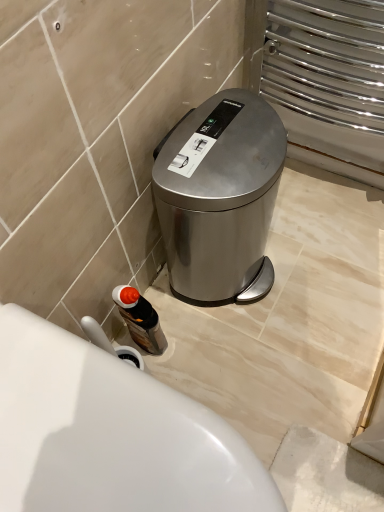
Question: Is satin metallic trash can at lower right turned away from translucent plastic bottle at lower left?

Choices:
 (A) yes
 (B) no

Answer: (B)

Question: Is satin metallic trash can at lower right oriented towards translucent plastic bottle at lower left?

Choices:
 (A) yes
 (B) no

Answer: (B)

Question: Is the position of satin metallic trash can at lower right less distant than that of translucent plastic bottle at lower left?

Choices:
 (A) yes
 (B) no

Answer: (A)

Question: Are satin metallic trash can at lower right and translucent plastic bottle at lower left beside each other?

Choices:
 (A) no
 (B) yes

Answer: (A)

Question: Considering the relative sizes of satin metallic trash can at lower right and translucent plastic bottle at lower left in the image provided, is satin metallic trash can at lower right bigger than translucent plastic bottle at lower left?

Choices:
 (A) no
 (B) yes

Answer: (B)

Question: Is point (114, 424) closer or farther from the camera than point (215, 297)?

Choices:
 (A) closer
 (B) farther

Answer: (A)

Question: Based on their sizes in the image, would you say white glossy toilet at lower left is bigger or smaller than satin metallic trash can at lower right?

Choices:
 (A) big
 (B) small

Answer: (A)

Question: Considering the positions of white glossy toilet at lower left and satin metallic trash can at lower right in the image, is white glossy toilet at lower left taller or shorter than satin metallic trash can at lower right?

Choices:
 (A) short
 (B) tall

Answer: (A)

Question: Do you think white glossy toilet at lower left is within satin metallic trash can at lower right, or outside of it?

Choices:
 (A) outside
 (B) inside

Answer: (A)

Question: Considering their positions, is satin metallic trash can at lower right located in front of or behind translucent plastic bottle at lower left?

Choices:
 (A) front
 (B) behind

Answer: (A)

Question: From the image's perspective, relative to translucent plastic bottle at lower left, is satin metallic trash can at lower right above or below?

Choices:
 (A) above
 (B) below

Answer: (A)

Question: From their relative heights in the image, would you say satin metallic trash can at lower right is taller or shorter than translucent plastic bottle at lower left?

Choices:
 (A) short
 (B) tall

Answer: (B)

Question: Visually, is satin metallic trash can at lower right positioned to the left or to the right of translucent plastic bottle at lower left?

Choices:
 (A) right
 (B) left

Answer: (A)

Question: Considering the positions of translucent plastic bottle at lower left and white glossy toilet at lower left in the image, is translucent plastic bottle at lower left bigger or smaller than white glossy toilet at lower left?

Choices:
 (A) big
 (B) small

Answer: (B)

Question: Choose the correct answer: Is translucent plastic bottle at lower left inside white glossy toilet at lower left or outside it?

Choices:
 (A) inside
 (B) outside

Answer: (B)